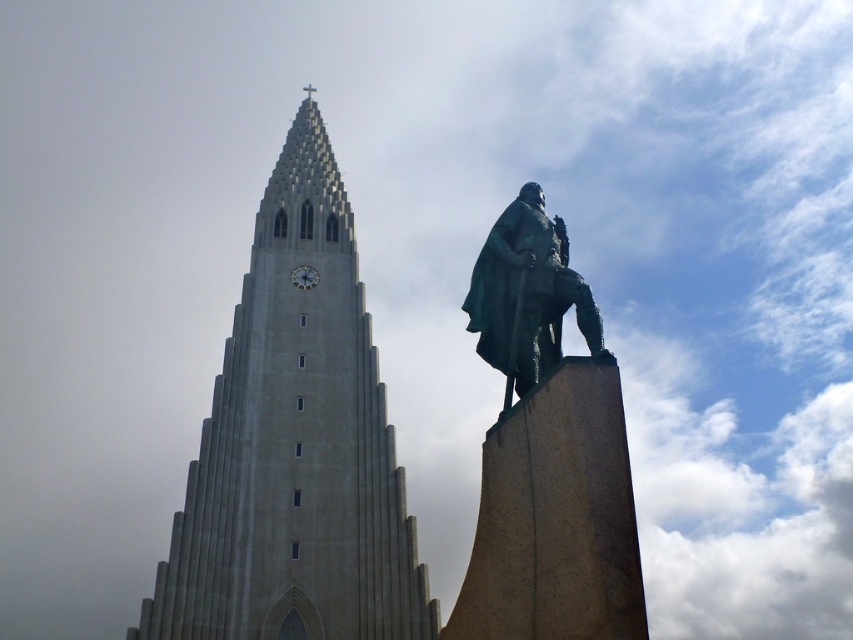
Question: Which point is closer to the camera taking this photo?

Choices:
 (A) 274,582
 (B) 606,360

Answer: (B)

Question: Which point is closer to the camera taking this photo?

Choices:
 (A) (372, 470)
 (B) (555, 323)

Answer: (B)

Question: Does gray stone tower at center have a smaller size compared to bronze statue at right?

Choices:
 (A) no
 (B) yes

Answer: (A)

Question: Is gray stone tower at center to the right of bronze statue at right from the viewer's perspective?

Choices:
 (A) no
 (B) yes

Answer: (A)

Question: Does gray stone tower at center have a lesser width compared to bronze statue at right?

Choices:
 (A) yes
 (B) no

Answer: (B)